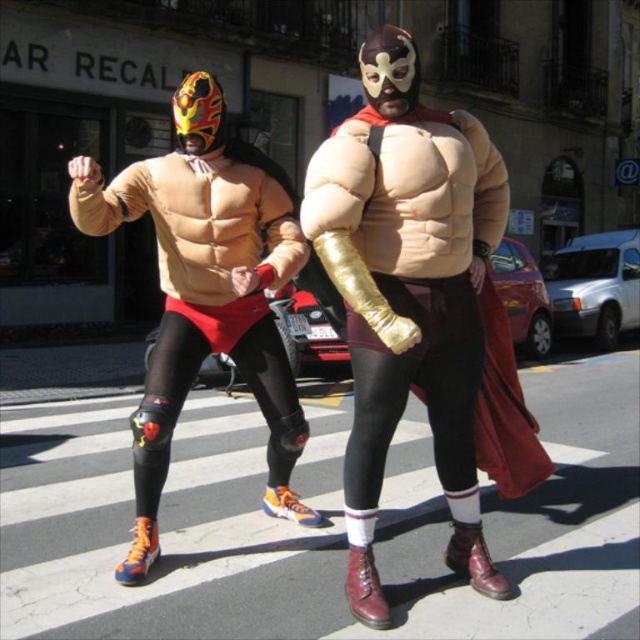
Is matte gold arm at center shorter than matte orange athletic shoe at left?

In fact, matte gold arm at center may be taller than matte orange athletic shoe at left.

Can you confirm if matte gold arm at center is smaller than matte orange athletic shoe at left?

Indeed, matte gold arm at center has a smaller size compared to matte orange athletic shoe at left.

Locate an element on the screen. Image resolution: width=640 pixels, height=640 pixels. matte gold arm at center is located at coordinates (406, 292).